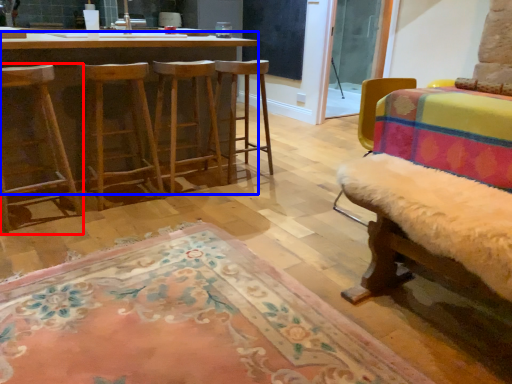
Question: Which object is closer to the camera taking this photo, chair (highlighted by a red box) or desk (highlighted by a blue box)?

Choices:
 (A) chair
 (B) desk

Answer: (A)